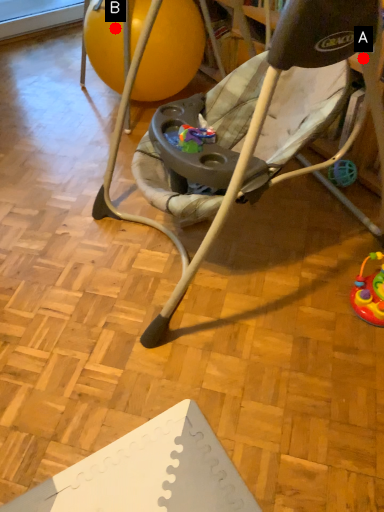
Question: Two points are circled on the image, labeled by A and B beside each circle. Which point is farther from the camera taking this photo?

Choices:
 (A) A is further
 (B) B is further

Answer: (B)